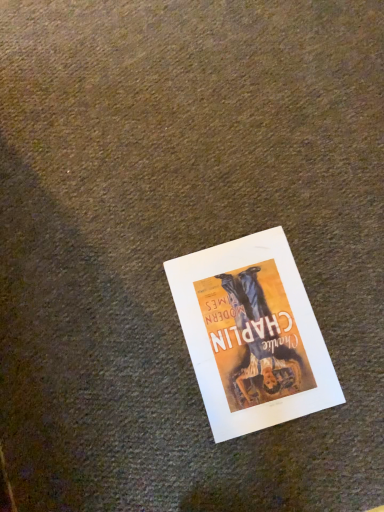
This screenshot has height=512, width=384. I want to click on vacant area that is situated to the right of white paper poster at center, so click(x=344, y=273).